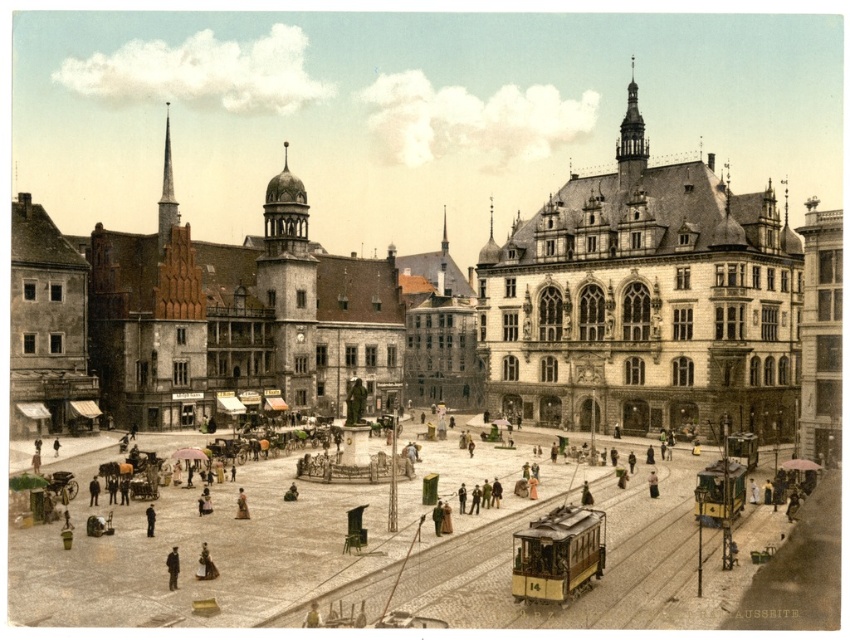
You are a photographer positioned at the edge of the town square. You want to capture a photo of the statue surrounded by the crowd while ensuring the brown leather jacket at center is not in the foreground. Based on the coordinates provided, can you position yourself to avoid the jacket?

The brown leather jacket at center is located at point (x=241, y=506). Since you are positioned at the edge of the town square, you can adjust your angle to avoid the jacket by moving slightly to the left or right to ensure it doesn not block the view of the statue and crowd.

You are a tailor in the town square observing two leather garments. The dark brown leather coat at lower left and the light brown leather jacket at center. Which garment would be easier to fold and store due to its material thickness?

The dark brown leather coat at lower left is thinner than the light brown leather jacket at center, so it would be easier to fold and store due to its thinner material.